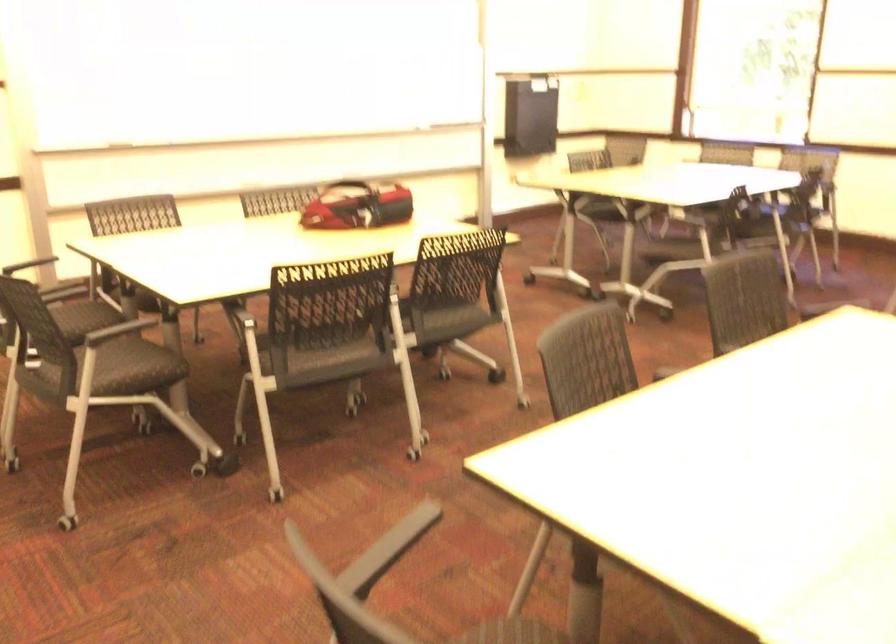
Describe the element at coordinates (347, 205) in the screenshot. I see `the black carrier handle` at that location.